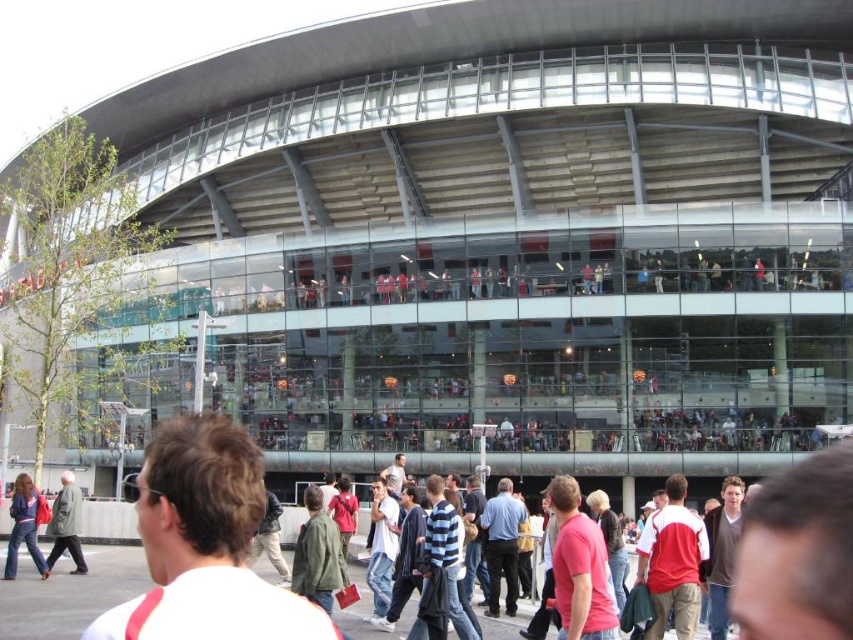
Which of these two, white matte shirt at center or green matte coat at lower left, stands taller?

white matte shirt at center

Is white matte shirt at center to the left of green matte coat at lower left from the viewer's perspective?

Incorrect, white matte shirt at center is not on the left side of green matte coat at lower left.

Where is `white matte shirt at center`? white matte shirt at center is located at coordinates click(206, 544).

Find the location of a particular element. This screenshot has width=853, height=640. white matte shirt at center is located at coordinates (206, 544).

This screenshot has width=853, height=640. Describe the element at coordinates (24, 525) in the screenshot. I see `denim jacket at lower left` at that location.

Does denim jacket at lower left have a greater width compared to green matte coat at lower left?

No.

Is point (22, 499) positioned after point (80, 520)?

No.

Identify the location of denim jacket at lower left. (24, 525).

Between white matte shirt at center and denim jacket at lower left, which one is positioned higher?

white matte shirt at center is higher up.

Does white matte shirt at center appear on the left side of denim jacket at lower left?

Incorrect, white matte shirt at center is not on the left side of denim jacket at lower left.

Between point (235, 516) and point (10, 563), which one is positioned behind?

Positioned behind is point (10, 563).

Where is `white matte shirt at center`? The image size is (853, 640). white matte shirt at center is located at coordinates (206, 544).